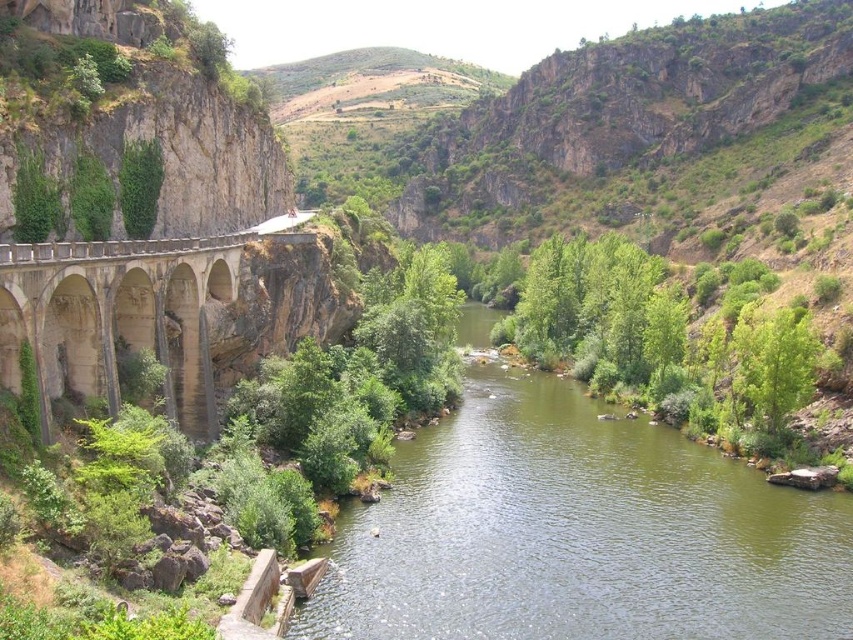
Question: Can you confirm if green smooth water at center is positioned above beige stone bridge at left?

Choices:
 (A) yes
 (B) no

Answer: (B)

Question: Can you confirm if green smooth water at center is positioned below beige stone bridge at left?

Choices:
 (A) no
 (B) yes

Answer: (B)

Question: Is green smooth water at center to the right of beige stone bridge at left from the viewer's perspective?

Choices:
 (A) yes
 (B) no

Answer: (A)

Question: Which of the following is the farthest from the observer?

Choices:
 (A) beige stone bridge at left
 (B) green smooth water at center

Answer: (B)